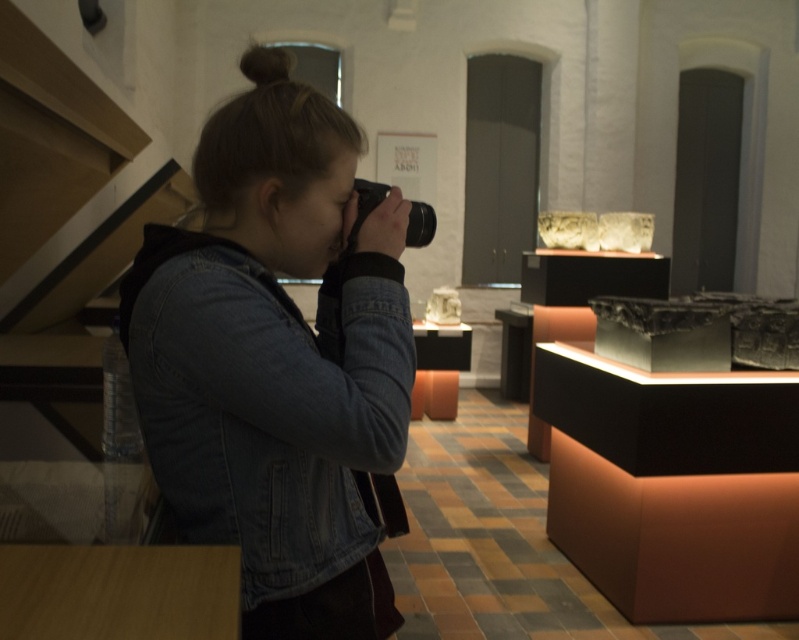
You are an art student visiting the museum and you see the denim jacket at center and the black plastic camera at center. Which object is positioned lower in the image?

The denim jacket at center is positioned lower than the black plastic camera at center in the image.

You are standing in the museum and see the denim jacket at center and the black plastic camera at center. Which object is positioned to the left when viewed from your perspective?

The denim jacket at center is to the left of the black plastic camera at center.

Where is the denim jacket at center located in the image?

The denim jacket at center is located at point (268,403) in the image.